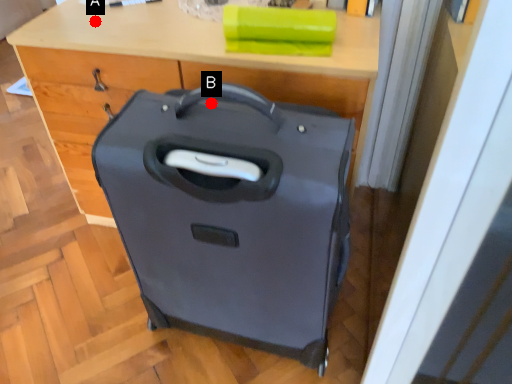
Question: Two points are circled on the image, labeled by A and B beside each circle. Among these points, which one is farthest from the camera?

Choices:
 (A) A is further
 (B) B is further

Answer: (A)